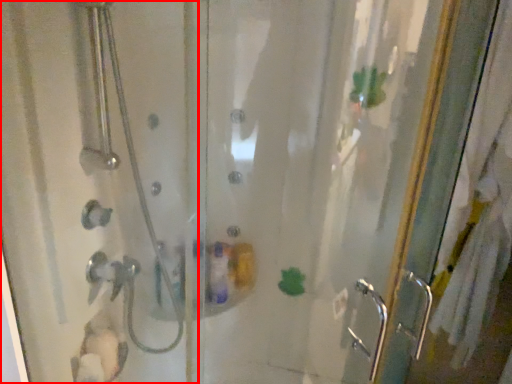
Question: In this image, where is shower door (annotated by the red box) located relative to screen door?

Choices:
 (A) right
 (B) left

Answer: (B)